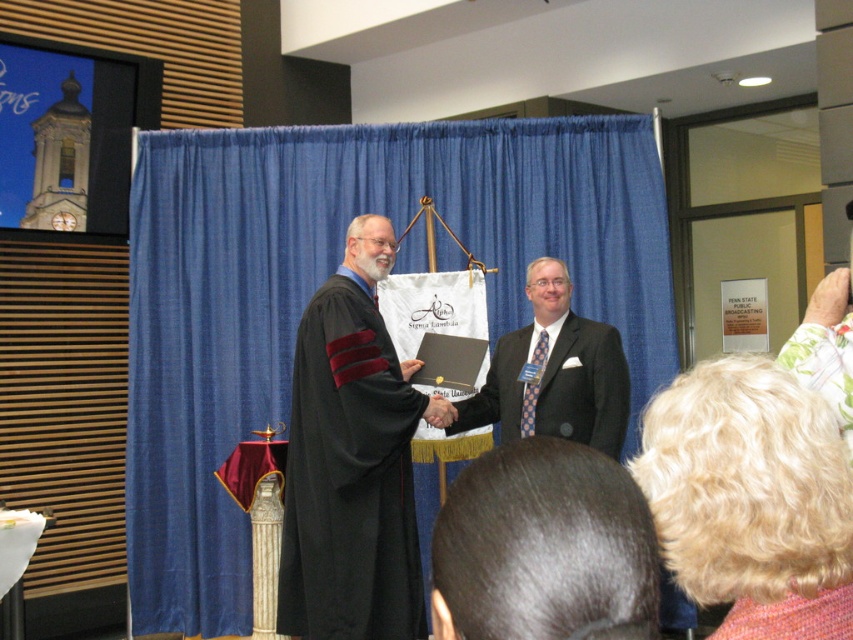
Question: Can you confirm if blue fabric curtain at center is positioned to the right of dark brown hair at center?

Choices:
 (A) yes
 (B) no

Answer: (B)

Question: Which of the following is the farthest from the observer?

Choices:
 (A) dark brown hair at center
 (B) blue fabric curtain at center

Answer: (B)

Question: Which point is farther to the camera?

Choices:
 (A) (628, 596)
 (B) (177, 147)
 (C) (410, 506)
 (D) (550, 410)

Answer: (B)

Question: Which object is positioned farthest from the dark brown hair at center?

Choices:
 (A) black matte graduation gown at center
 (B) black matte robe at center

Answer: (B)

Question: Does blue fabric curtain at center appear under black matte robe at center?

Choices:
 (A) no
 (B) yes

Answer: (A)

Question: Is blue fabric curtain at center to the right of black matte graduation gown at center from the viewer's perspective?

Choices:
 (A) no
 (B) yes

Answer: (A)